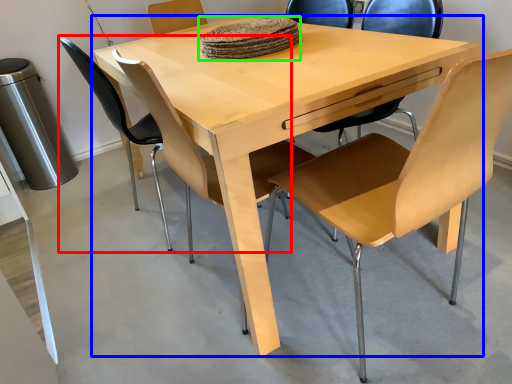
Question: Which object is positioned closest to chair (highlighted by a red box)? Select from table (highlighted by a blue box) and food (highlighted by a green box).

Choices:
 (A) table
 (B) food

Answer: (A)